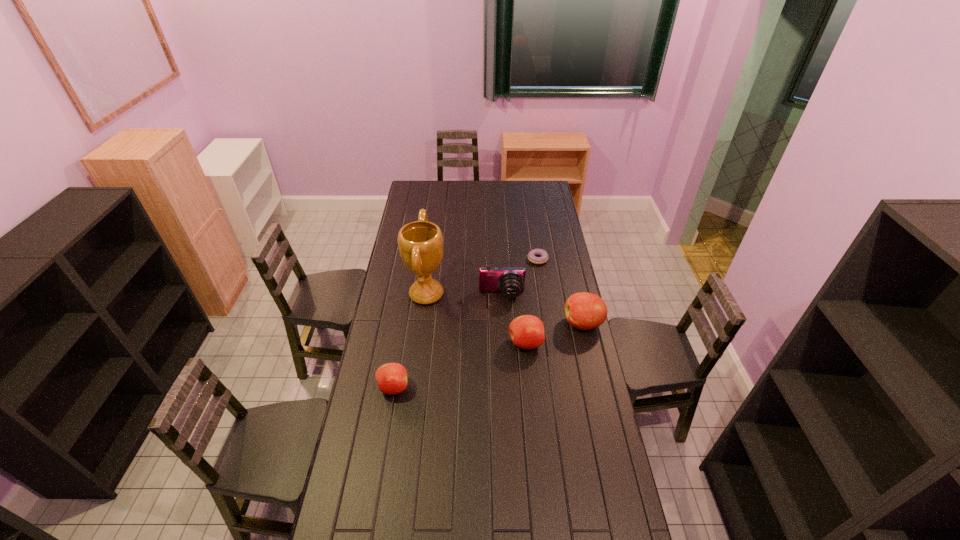
Identify the location of free space for an extra apple to achieve even spacing. (463, 364).